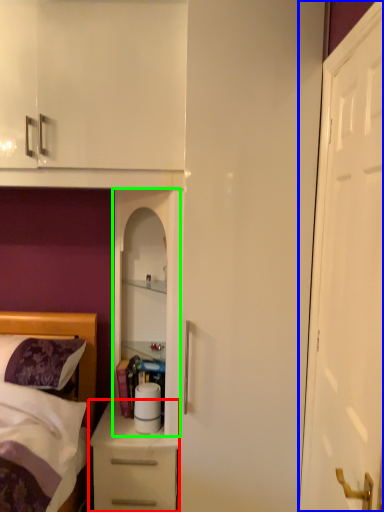
Question: Considering the real-world distances, which object is closest to chest of drawers (highlighted by a red box)? door (highlighted by a blue box) or cabinetry (highlighted by a green box).

Choices:
 (A) door
 (B) cabinetry

Answer: (B)